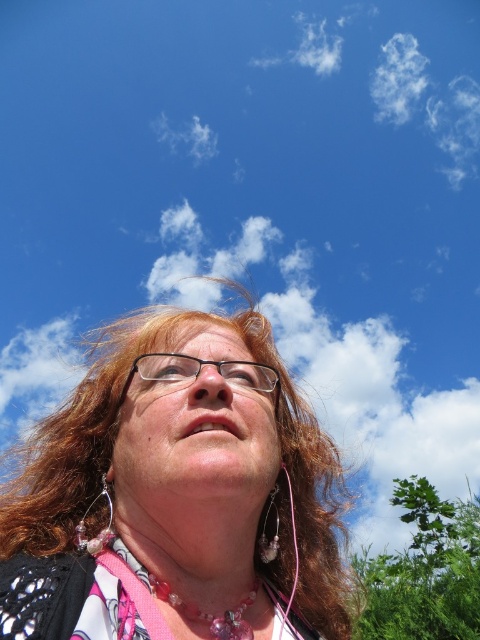
Question: Is matte black glasses at upper center to the left of clear plastic glasses at center from the viewer's perspective?

Choices:
 (A) yes
 (B) no

Answer: (B)

Question: Can you confirm if matte black glasses at upper center is positioned to the left of clear plastic glasses at center?

Choices:
 (A) yes
 (B) no

Answer: (B)

Question: Which point is closer to the camera?

Choices:
 (A) (157, 355)
 (B) (47, 500)

Answer: (A)

Question: Is matte black glasses at upper center below clear plastic glasses at center?

Choices:
 (A) yes
 (B) no

Answer: (A)

Question: Which point is closer to the camera taking this photo?

Choices:
 (A) (168, 397)
 (B) (146, 369)

Answer: (A)